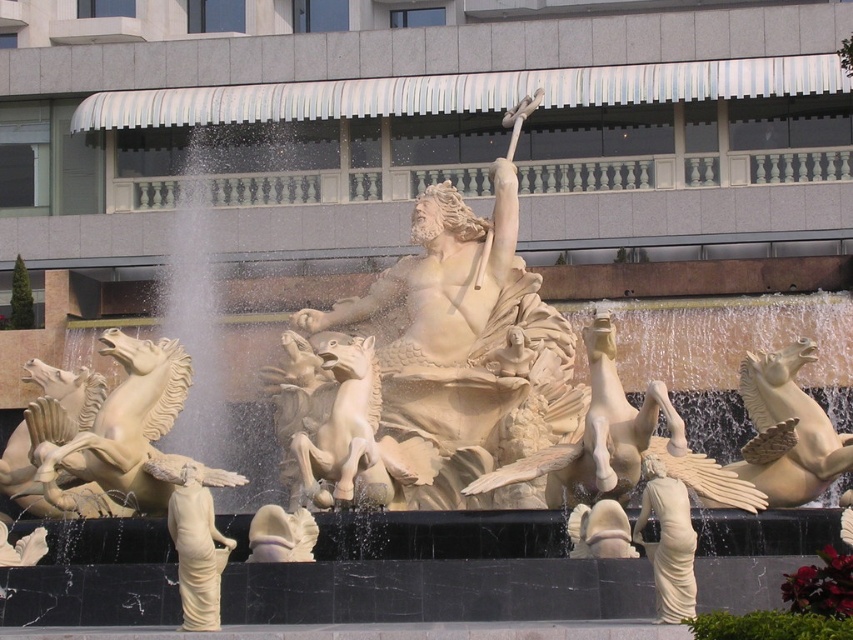
You are an art student analyzing the fountain sculpture. You notice the white marble statue at center and the beige stone horse at left. Which object is taller?

The white marble statue at center is taller than the beige stone horse at left.

You are an art curator planning to move the matte beige statue at lower center closer to the white marble statue at center. Based on their sizes, do you think there will be enough space between them?

The white marble statue at center might be wider than matte beige statue at lower center, so there might not be enough space between them if they are placed too close.